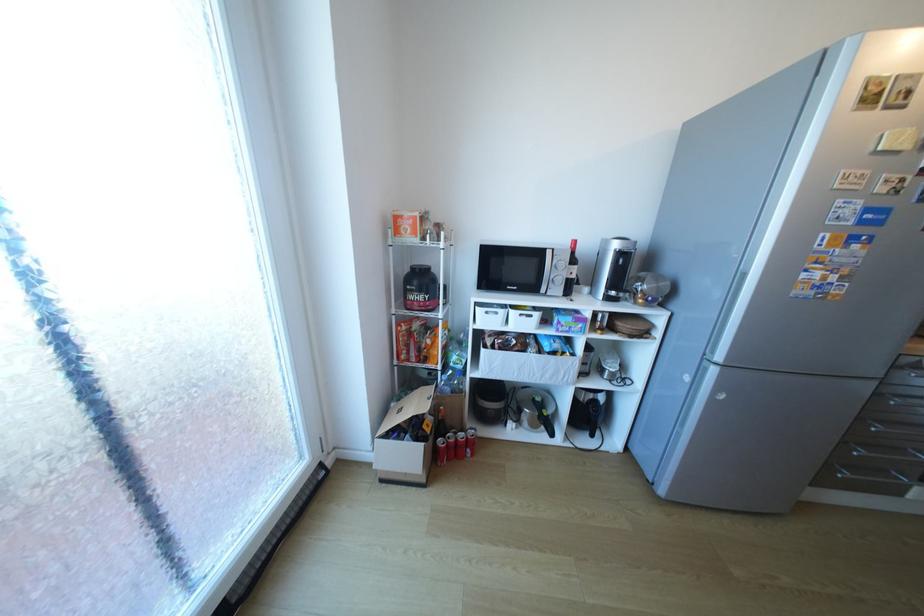
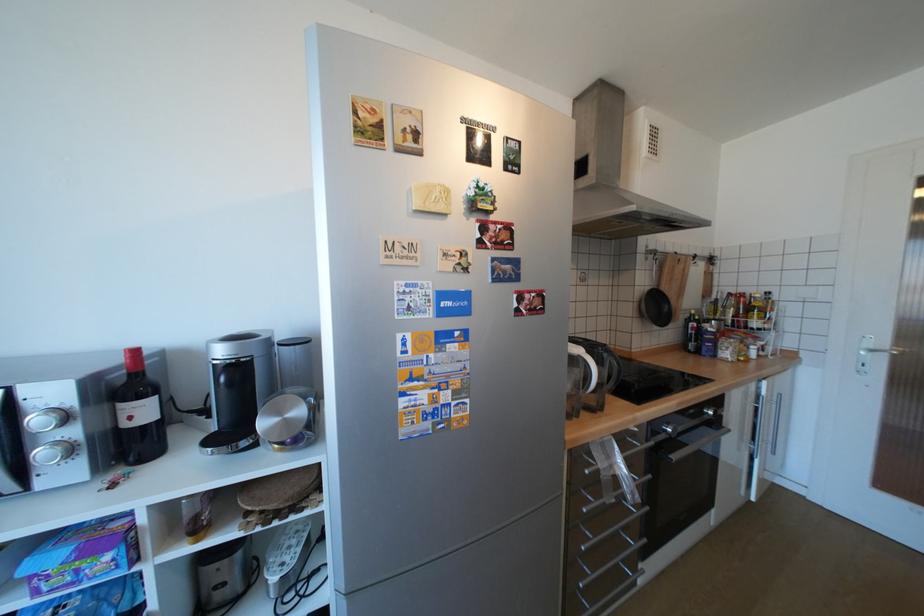
Where in the second image is the point corresponding to the point at 650,301 from the first image?

(286, 446)